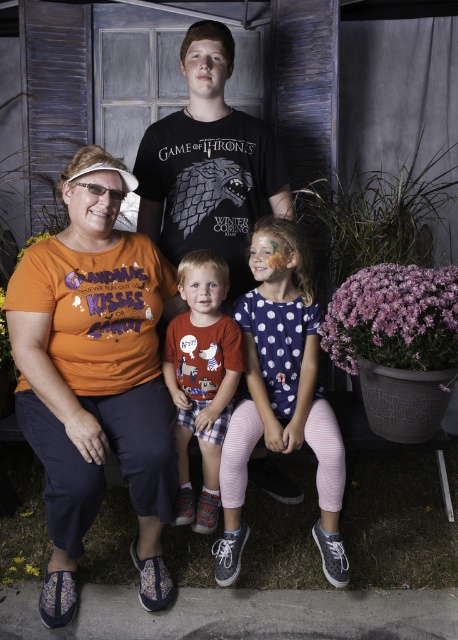
Between orange fabric shirt at lower left and black cotton t-shirt at center, which one has more height?

orange fabric shirt at lower left is taller.

Does orange fabric shirt at lower left have a lesser height compared to black cotton t-shirt at center?

No, orange fabric shirt at lower left is not shorter than black cotton t-shirt at center.

Where is `orange fabric shirt at lower left`? orange fabric shirt at lower left is located at coordinates (96, 376).

I want to click on orange fabric shirt at lower left, so click(96, 376).

Does orange fabric shirt at lower left appear on the left side of printed cotton t-shirt at center?

Yes, orange fabric shirt at lower left is to the left of printed cotton t-shirt at center.

Between orange fabric shirt at lower left and printed cotton t-shirt at center, which one is positioned lower?

printed cotton t-shirt at center is below.

Which is in front, point (60, 410) or point (184, 522)?

Point (60, 410) is more forward.

This screenshot has height=640, width=458. In order to click on orange fabric shirt at lower left in this screenshot , I will do `click(96, 376)`.

Is point (299, 400) positioned before point (156, 156)?

Yes, point (299, 400) is closer to viewer.

Is polka dot fabric dress at center further to the viewer compared to black cotton t-shirt at center?

No, it is not.

Image resolution: width=458 pixels, height=640 pixels. In order to click on polka dot fabric dress at center in this screenshot , I will do `click(281, 394)`.